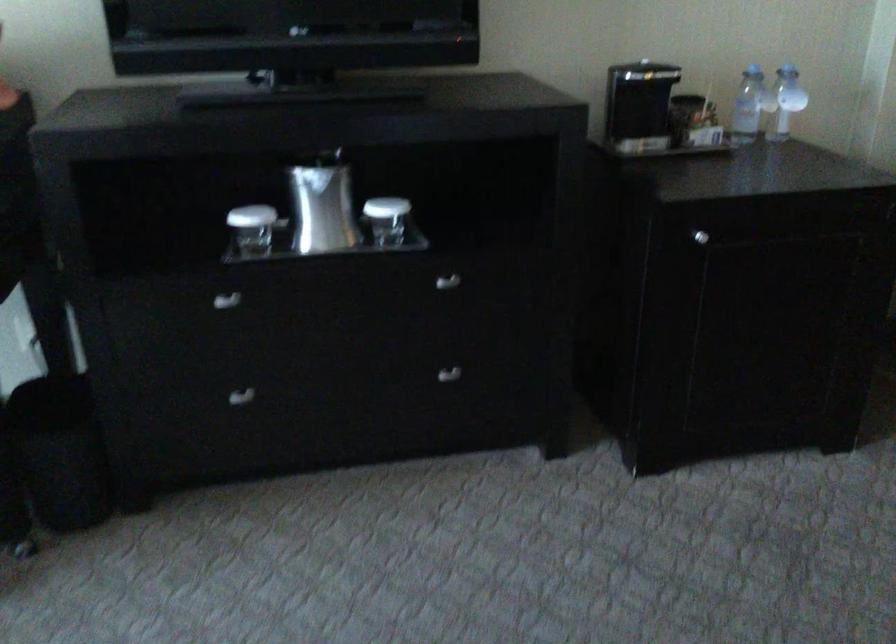
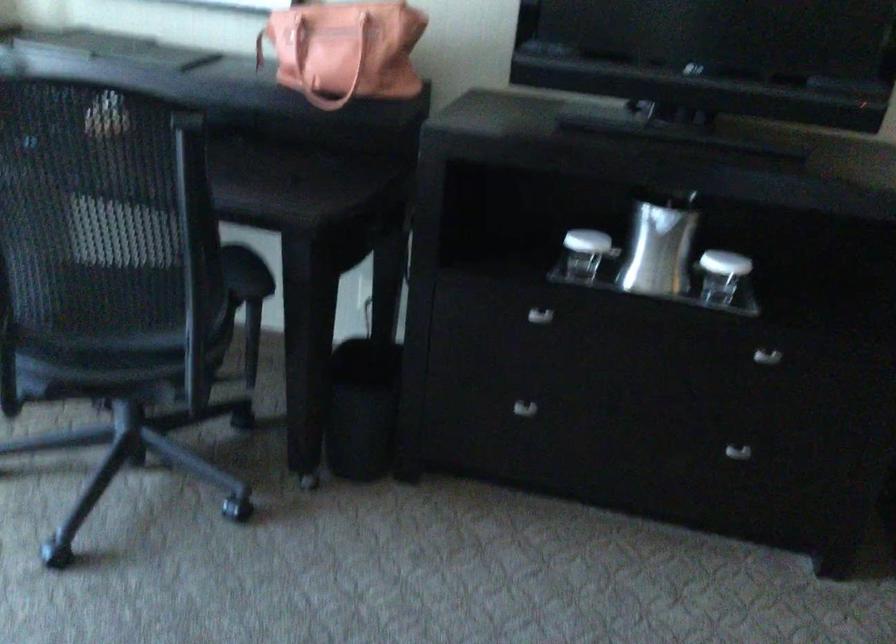
The point at [236,395] is marked in the first image. Where is the corresponding point in the second image?

(524, 408)